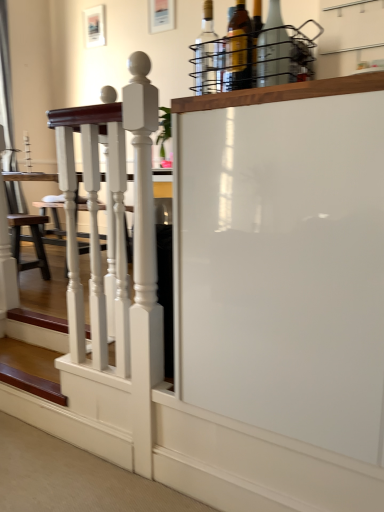
The height and width of the screenshot is (512, 384). What are the coordinates of `vacant region above wooden stairs at lower left (from a real-world perspective)` in the screenshot? It's located at (27, 356).